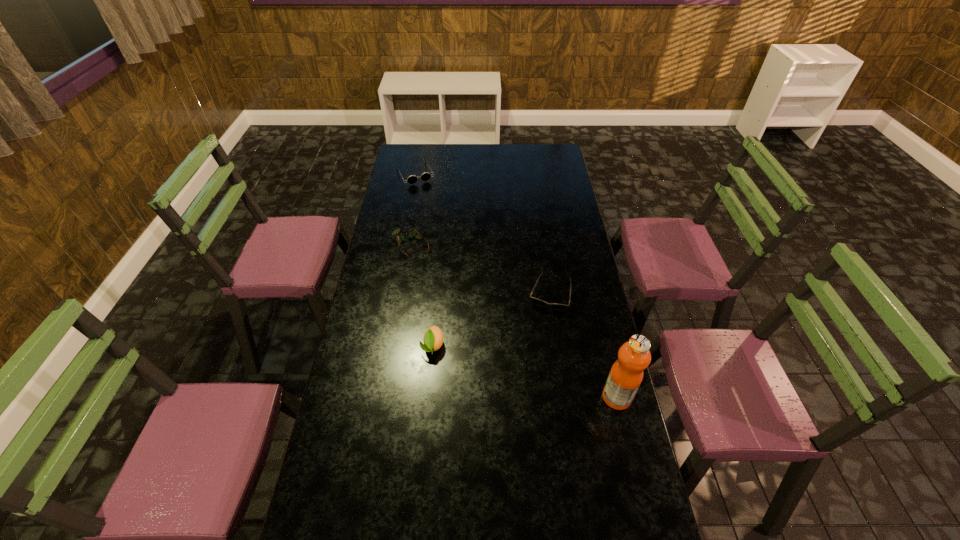
Find the location of a particular element. The width and height of the screenshot is (960, 540). free spot between the taller sunglasses and the tallest object is located at coordinates (516, 286).

This screenshot has width=960, height=540. What are the coordinates of `empty location between the third object from right to left and the fruit juice` in the screenshot? It's located at (524, 372).

Point out which object is positioned as the third nearest to the left sunglasses. Please provide its 2D coordinates. Your answer should be formatted as a tuple, i.e. [(x, y)], where the tuple contains the x and y coordinates of a point satisfying the conditions above.

[(433, 338)]

Select which object is the fourth closest to the spectacles. Please provide its 2D coordinates. Your answer should be formatted as a tuple, i.e. [(x, y)], where the tuple contains the x and y coordinates of a point satisfying the conditions above.

[(626, 374)]